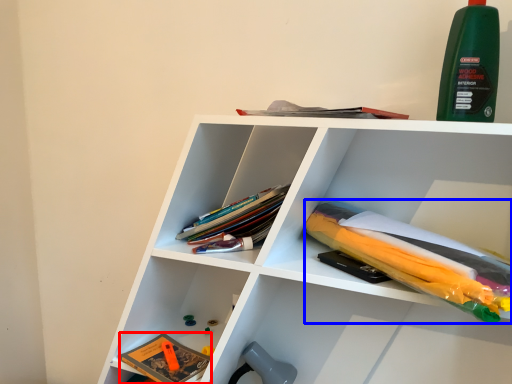
Question: Which point is further to the camera, book (highlighted by a red box) or book (highlighted by a blue box)?

Choices:
 (A) book
 (B) book

Answer: (A)